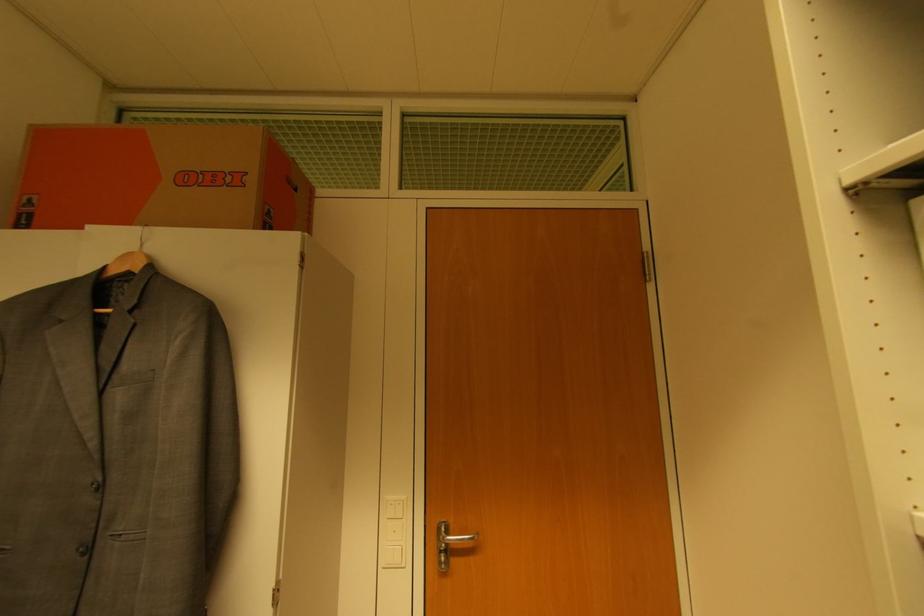
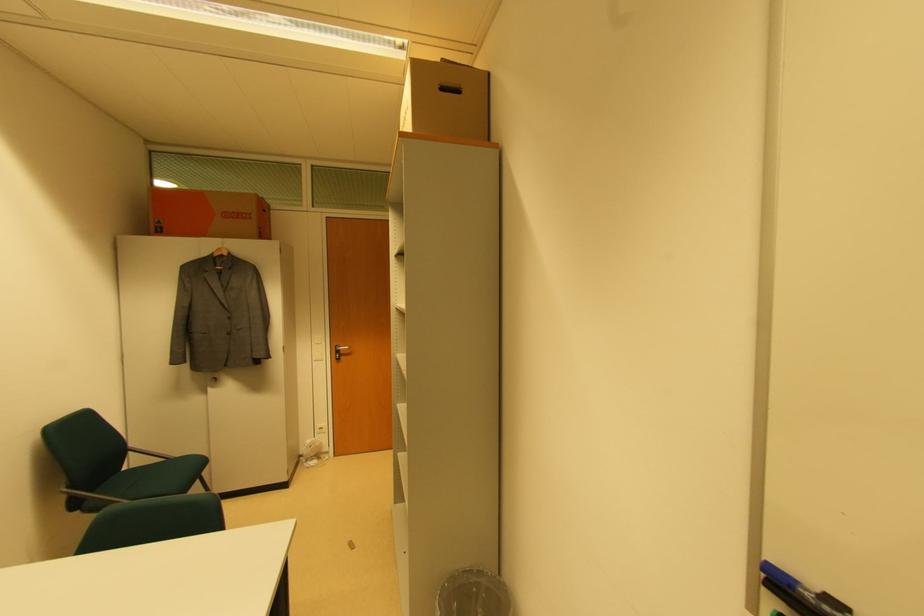
Question: What movement of the cameraman would produce the second image?

Choices:
 (A) Left
 (B) Right
 (C) Forward
 (D) Backward

Answer: (D)